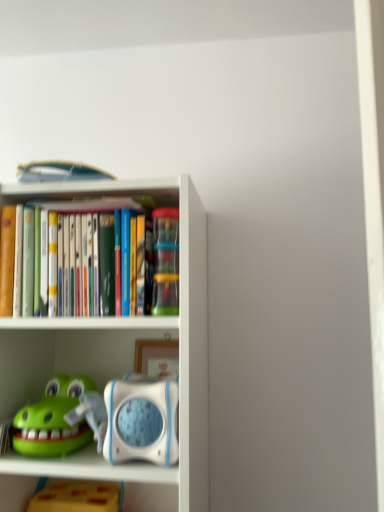
What do you see at coordinates (165, 261) in the screenshot?
I see `translucent plastic containers at center, the 1th toy when ordered from top to bottom` at bounding box center [165, 261].

How much space does translucent plastic containers at center, the 1th toy when ordered from top to bottom, occupy horizontally?

It is 2.51 inches.

The image size is (384, 512). What do you see at coordinates (54, 419) in the screenshot?
I see `green rubber toy at lower left, which is counted as the second toy, starting from the bottom` at bounding box center [54, 419].

What is the approximate height of green rubber toy at lower left, which is counted as the second toy, starting from the bottom?

green rubber toy at lower left, which is counted as the second toy, starting from the bottom, is 5.37 inches in height.

You are a GUI agent. You are given a task and a screenshot of the screen. Output one action in this format:
    pyautogui.click(x=<x>, y=<y>)
    Task: Click on the yellow matte block at lower left, which is counted as the third toy, starting from the top
    
    Given the screenshot: What is the action you would take?
    pyautogui.click(x=78, y=497)

Is translucent plastic containers at center, the 1th toy when ordered from top to bottom, far from yellow matte block at lower left, the 1th toy when ordered from bottom to top?

No, translucent plastic containers at center, the 1th toy when ordered from top to bottom, is not far from yellow matte block at lower left, the 1th toy when ordered from bottom to top.

From the picture: From a real-world perspective, relative to yellow matte block at lower left, which is counted as the third toy, starting from the top, is translucent plastic containers at center, positioned as the 3th toy in bottom-to-top order, vertically above or below?

translucent plastic containers at center, positioned as the 3th toy in bottom-to-top order, is above yellow matte block at lower left, which is counted as the third toy, starting from the top.

Is yellow matte block at lower left, which is counted as the third toy, starting from the top, at the back of translucent plastic containers at center, the 1th toy when ordered from top to bottom?

translucent plastic containers at center, the 1th toy when ordered from top to bottom, does not have its back to yellow matte block at lower left, which is counted as the third toy, starting from the top.

Is translucent plastic containers at center, positioned as the 3th toy in bottom-to-top order, not inside yellow matte block at lower left, which is counted as the third toy, starting from the top?

Yes, translucent plastic containers at center, positioned as the 3th toy in bottom-to-top order, is not within yellow matte block at lower left, which is counted as the third toy, starting from the top.

Which is further, (174, 294) or (68, 333)?

The point (68, 333) is farther from the camera.

From the picture: From the image's perspective, which is above, translucent plastic containers at center, positioned as the 3th toy in bottom-to-top order, or white plastic shelf at center?

translucent plastic containers at center, positioned as the 3th toy in bottom-to-top order, is shown above in the image.

In terms of height, does translucent plastic containers at center, positioned as the 3th toy in bottom-to-top order, look taller or shorter compared to white plastic shelf at center?

In the image, translucent plastic containers at center, positioned as the 3th toy in bottom-to-top order, appears to be shorter than white plastic shelf at center.

Is white plastic shelf at center a part of translucent plastic containers at center, the 1th toy when ordered from top to bottom?

Actually, white plastic shelf at center is outside translucent plastic containers at center, the 1th toy when ordered from top to bottom.

Considering their positions, is green rubber toy at lower left, acting as the second toy starting from the top, located in front of or behind yellow matte block at lower left, the 1th toy when ordered from bottom to top?

In the image, green rubber toy at lower left, acting as the second toy starting from the top, appears in front of yellow matte block at lower left, the 1th toy when ordered from bottom to top.

Which of these two, green rubber toy at lower left, acting as the second toy starting from the top, or yellow matte block at lower left, which is counted as the third toy, starting from the top, stands taller?

Standing taller between the two is yellow matte block at lower left, which is counted as the third toy, starting from the top.

Is green rubber toy at lower left, which is counted as the second toy, starting from the bottom, spatially inside yellow matte block at lower left, which is counted as the third toy, starting from the top, or outside of it?

green rubber toy at lower left, which is counted as the second toy, starting from the bottom, cannot be found inside yellow matte block at lower left, which is counted as the third toy, starting from the top.

Can you confirm if green rubber toy at lower left, acting as the second toy starting from the top, is bigger than yellow matte block at lower left, which is counted as the third toy, starting from the top?

No.

Looking at the image, does translucent plastic containers at center, positioned as the 3th toy in bottom-to-top order, seem bigger or smaller compared to green rubber toy at lower left, acting as the second toy starting from the top?

Considering their sizes, translucent plastic containers at center, positioned as the 3th toy in bottom-to-top order, takes up less space than green rubber toy at lower left, acting as the second toy starting from the top.

Is translucent plastic containers at center, the 1th toy when ordered from top to bottom, positioned far away from green rubber toy at lower left, which is counted as the second toy, starting from the bottom?

That's not correct — translucent plastic containers at center, the 1th toy when ordered from top to bottom, is a little close to green rubber toy at lower left, which is counted as the second toy, starting from the bottom.

Between translucent plastic containers at center, positioned as the 3th toy in bottom-to-top order, and green rubber toy at lower left, which is counted as the second toy, starting from the bottom, which one has more height?

Standing taller between the two is translucent plastic containers at center, positioned as the 3th toy in bottom-to-top order.

From the image's perspective, is translucent plastic containers at center, positioned as the 3th toy in bottom-to-top order, beneath green rubber toy at lower left, acting as the second toy starting from the top?

Incorrect, from the image's perspective, translucent plastic containers at center, positioned as the 3th toy in bottom-to-top order, is higher than green rubber toy at lower left, acting as the second toy starting from the top.

From a real-world perspective, who is located higher, green rubber toy at lower left, which is counted as the second toy, starting from the bottom, or white plastic shelf at center?

From a 3D spatial view, white plastic shelf at center is above.

Looking at the image, does green rubber toy at lower left, acting as the second toy starting from the top, seem bigger or smaller compared to white plastic shelf at center?

Considering their sizes, green rubber toy at lower left, acting as the second toy starting from the top, takes up less space than white plastic shelf at center.

Is green rubber toy at lower left, acting as the second toy starting from the top, touching white plastic shelf at center?

No, green rubber toy at lower left, acting as the second toy starting from the top, is not with white plastic shelf at center.

Does green rubber toy at lower left, acting as the second toy starting from the top, appear on the right side of white plastic shelf at center?

In fact, green rubber toy at lower left, acting as the second toy starting from the top, is to the left of white plastic shelf at center.

Consider the image. From the image's perspective, relative to translucent plastic containers at center, the 1th toy when ordered from top to bottom, is green rubber toy at lower left, acting as the second toy starting from the top, above or below?

green rubber toy at lower left, acting as the second toy starting from the top, is below translucent plastic containers at center, the 1th toy when ordered from top to bottom.

From a real-world perspective, which is physically above, green rubber toy at lower left, which is counted as the second toy, starting from the bottom, or translucent plastic containers at center, the 1th toy when ordered from top to bottom?

translucent plastic containers at center, the 1th toy when ordered from top to bottom.

Visually, is green rubber toy at lower left, which is counted as the second toy, starting from the bottom, positioned to the left or to the right of translucent plastic containers at center, the 1th toy when ordered from top to bottom?

green rubber toy at lower left, which is counted as the second toy, starting from the bottom, is to the left of translucent plastic containers at center, the 1th toy when ordered from top to bottom.

At what (x,y) coordinates should I click in order to perform the action: click on the 1st toy behind the green rubber toy at lower left, which is counted as the second toy, starting from the bottom. Please return your answer as a coordinate pair (x, y). Looking at the image, I should click on (165, 261).

Is point (44, 501) closer or farther from the camera than point (140, 318)?

Point (44, 501) is positioned farther from the camera compared to point (140, 318).

From the image's perspective, between yellow matte block at lower left, the 1th toy when ordered from bottom to top, and white plastic shelf at center, which one is located above?

From the image's view, white plastic shelf at center is above.

Is yellow matte block at lower left, which is counted as the third toy, starting from the top, oriented towards white plastic shelf at center?

Yes, yellow matte block at lower left, which is counted as the third toy, starting from the top, is facing white plastic shelf at center.

How much distance is there between yellow matte block at lower left, the 1th toy when ordered from bottom to top, and white plastic shelf at center?

yellow matte block at lower left, the 1th toy when ordered from bottom to top, and white plastic shelf at center are 14.14 inches apart.

From the image's perspective, count 2nd toys downward from the translucent plastic containers at center, positioned as the 3th toy in bottom-to-top order, and point to it. Please provide its 2D coordinates.

[(78, 497)]

There is a white plastic shelf at center. Find the location of `toy above it (from a real-world perspective)`. toy above it (from a real-world perspective) is located at coordinates (165, 261).

From the image, which object appears to be nearer to yellow matte block at lower left, the 1th toy when ordered from bottom to top, translucent plastic containers at center, the 1th toy when ordered from top to bottom, or white plastic shelf at center?

white plastic shelf at center is positioned closer to the anchor yellow matte block at lower left, the 1th toy when ordered from bottom to top.

When comparing their distances from green rubber toy at lower left, which is counted as the second toy, starting from the bottom, does translucent plastic containers at center, the 1th toy when ordered from top to bottom, or white plastic shelf at center seem further?

Based on the image, translucent plastic containers at center, the 1th toy when ordered from top to bottom, appears to be further to green rubber toy at lower left, which is counted as the second toy, starting from the bottom.

When comparing their distances from white plastic shelf at center, does green rubber toy at lower left, which is counted as the second toy, starting from the bottom, or yellow matte block at lower left, which is counted as the third toy, starting from the top, seem further?

Among the two, yellow matte block at lower left, which is counted as the third toy, starting from the top, is located further to white plastic shelf at center.

Based on their spatial positions, is green rubber toy at lower left, acting as the second toy starting from the top, or white plastic shelf at center further from translucent plastic containers at center, positioned as the 3th toy in bottom-to-top order?

green rubber toy at lower left, acting as the second toy starting from the top, is positioned further to the anchor translucent plastic containers at center, positioned as the 3th toy in bottom-to-top order.

Considering their positions, is green rubber toy at lower left, which is counted as the second toy, starting from the bottom, positioned closer to yellow matte block at lower left, which is counted as the third toy, starting from the top, than white plastic shelf at center?

green rubber toy at lower left, which is counted as the second toy, starting from the bottom.

When comparing their distances from yellow matte block at lower left, the 1th toy when ordered from bottom to top, does white plastic shelf at center or translucent plastic containers at center, positioned as the 3th toy in bottom-to-top order, seem further?

The object further to yellow matte block at lower left, the 1th toy when ordered from bottom to top, is translucent plastic containers at center, positioned as the 3th toy in bottom-to-top order.

When comparing their distances from white plastic shelf at center, does translucent plastic containers at center, positioned as the 3th toy in bottom-to-top order, or yellow matte block at lower left, which is counted as the third toy, starting from the top, seem further?

yellow matte block at lower left, which is counted as the third toy, starting from the top, is positioned further to the anchor white plastic shelf at center.

Based on their spatial positions, is green rubber toy at lower left, acting as the second toy starting from the top, or translucent plastic containers at center, the 1th toy when ordered from top to bottom, further from yellow matte block at lower left, the 1th toy when ordered from bottom to top?

translucent plastic containers at center, the 1th toy when ordered from top to bottom.

At what (x,y) coordinates should I click in order to perform the action: click on toy between white plastic shelf at center and yellow matte block at lower left, which is counted as the third toy, starting from the top, in the vertical direction. Please return your answer as a coordinate pair (x, y). Looking at the image, I should click on (54, 419).

The width and height of the screenshot is (384, 512). What are the coordinates of `toy between translucent plastic containers at center, the 1th toy when ordered from top to bottom, and yellow matte block at lower left, which is counted as the third toy, starting from the top, from top to bottom` in the screenshot? It's located at (54, 419).

The image size is (384, 512). I want to click on shelf between translucent plastic containers at center, positioned as the 3th toy in bottom-to-top order, and yellow matte block at lower left, which is counted as the third toy, starting from the top, in the up-down direction, so click(x=121, y=353).

This screenshot has height=512, width=384. I want to click on shelf between translucent plastic containers at center, positioned as the 3th toy in bottom-to-top order, and green rubber toy at lower left, which is counted as the second toy, starting from the bottom, vertically, so click(121, 353).